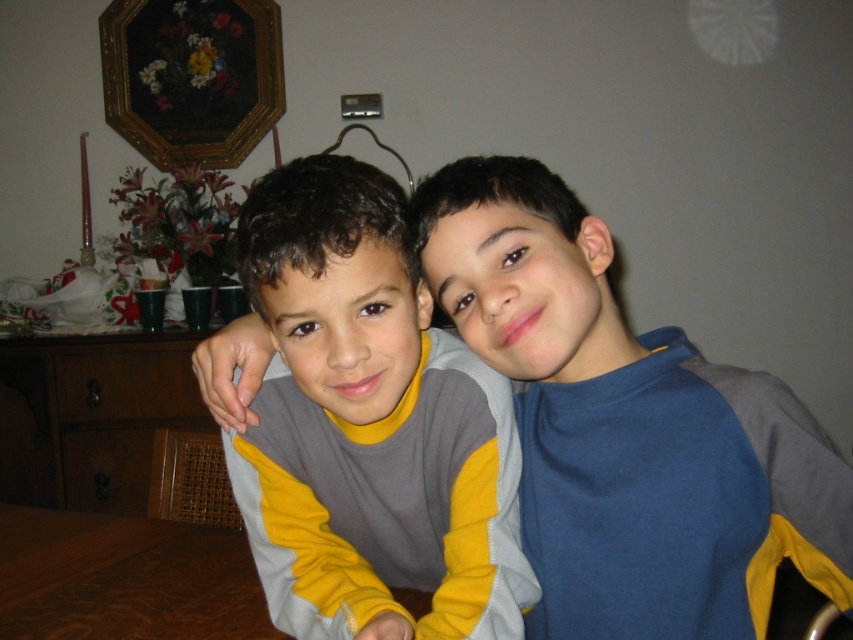
You are a photographer holding a camera and standing in front of the wooden table at lower left. You want to take a photo of the table. Can you step back to a distance of 40 inches from the table to get a wider shot?

The wooden table at lower left and camera are currently 37.23 inches apart. To step back to 40 inches, you need to move an additional 2.77 inches away from the table.

You are standing in the room where the two boys are sitting. You want to place a small gift between the two points marked as point [151,600] and point [213,166]. Based on their positions, which point is closer to you, and where should you place the gift to ensure it is between them?

Point [151,600] is in front of point [213,166]. To place the gift between them, you should position it closer to point [151,600] since it is nearer to you.

You are taking a photo of two boys sitting on a wooden cabinet with a floral arrangement. You notice two points marked at coordinates point (317,182) and point (170,164). Which point is closer to the camera?

Point (317,182) is closer to the camera than point (170,164).